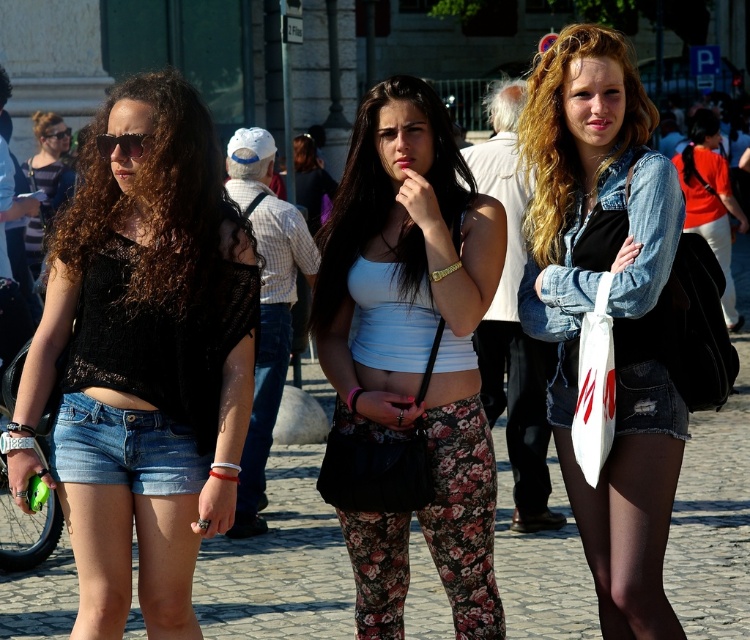
Question: Estimate the real-world distances between objects in this image. Which object is farther from the denim shorts at lower left?

Choices:
 (A) denim jacket at lower right
 (B) cobblestone pavement at center

Answer: (B)

Question: In this image, where is white matte tank top at center located relative to denim jacket at lower right?

Choices:
 (A) left
 (B) right

Answer: (A)

Question: Is cobblestone pavement at center above denim jacket at lower right?

Choices:
 (A) no
 (B) yes

Answer: (A)

Question: Which point is closer to the camera taking this photo?

Choices:
 (A) (615, 333)
 (B) (21, 600)
 (C) (159, 273)

Answer: (C)

Question: Can you confirm if cobblestone pavement at center is positioned above matte black top at left?

Choices:
 (A) no
 (B) yes

Answer: (A)

Question: Among these objects, which one is nearest to the camera?

Choices:
 (A) denim shorts at lower left
 (B) denim jacket at center
 (C) matte black top at left
 (D) cobblestone pavement at center

Answer: (A)